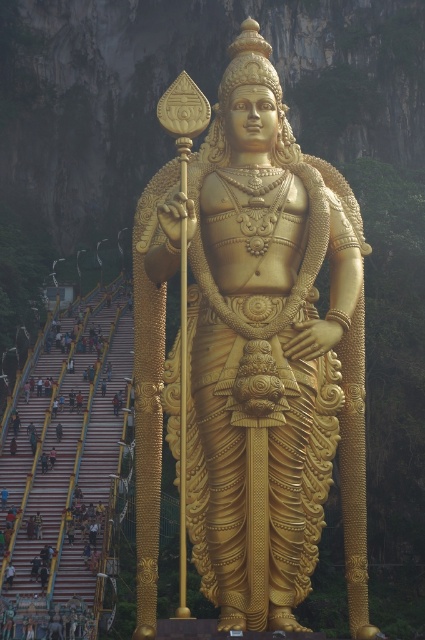
Which is below, golden polished statue at center or golden statue at center?

golden statue at center is below.

Which is more to the right, golden polished statue at center or golden statue at center?

From the viewer's perspective, golden polished statue at center appears more on the right side.

The width and height of the screenshot is (425, 640). Identify the location of golden polished statue at center. (254, 358).

Does golden statue at center have a greater width compared to light brown fabric pants at lower center?

Correct, the width of golden statue at center exceeds that of light brown fabric pants at lower center.

Which of these two, golden statue at center or light brown fabric pants at lower center, stands shorter?

light brown fabric pants at lower center

Where is `golden statue at center`? This screenshot has width=425, height=640. golden statue at center is located at coordinates (44, 461).

Is point (275, 410) less distant than point (50, 452)?

Yes, point (275, 410) is in front of point (50, 452).

Is point (257, 451) closer to camera compared to point (51, 461)?

Yes, it is in front of point (51, 461).

Identify the location of golden polished statue at center. The height and width of the screenshot is (640, 425). (254, 358).